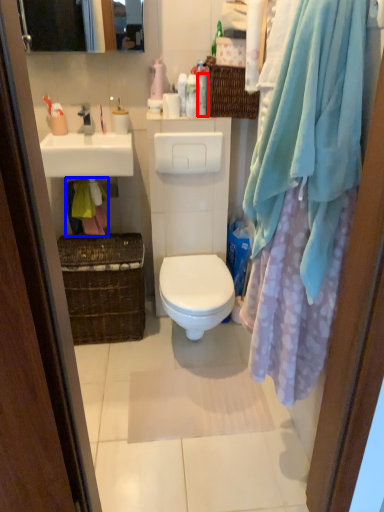
Question: Which of the following is the farthest to the observer, toiletry (highlighted by a red box) or material (highlighted by a blue box)?

Choices:
 (A) toiletry
 (B) material

Answer: (B)